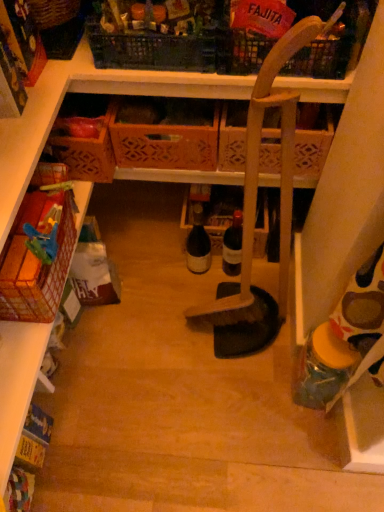
You are a GUI agent. You are given a task and a screenshot of the screen. Output one action in this format:
    pyautogui.click(x=<x>, y=<y>)
    Task: Click on the free space to the left of matte glass bottle at center, the first bottle when ordered from left to right
    
    Given the screenshot: What is the action you would take?
    pyautogui.click(x=159, y=268)